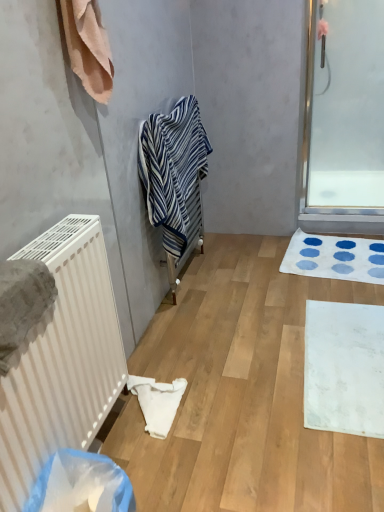
You are a GUI agent. You are given a task and a screenshot of the screen. Output one action in this format:
    pyautogui.click(x=<x>, y=<y>)
    Task: Click on the free space in front of white fabric towel at lower center
    This screenshot has height=512, width=384.
    Given the screenshot: What is the action you would take?
    tap(159, 463)